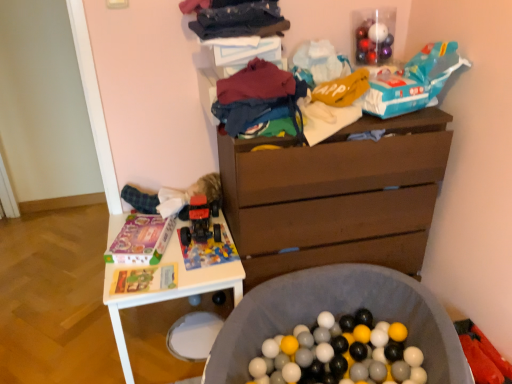
Image resolution: width=512 pixels, height=384 pixels. I want to click on free space above white plastic table at lower left (from a real-world perspective), so click(176, 250).